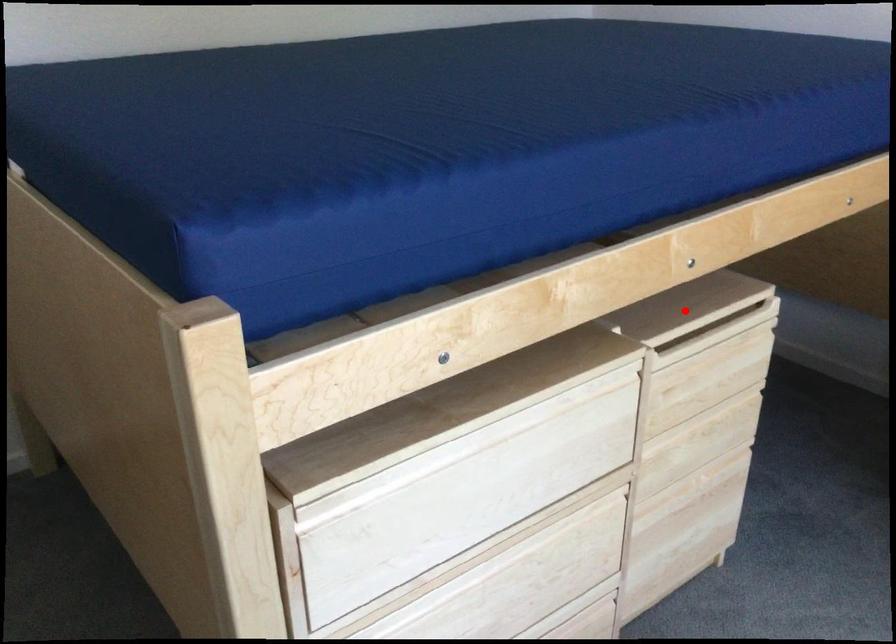
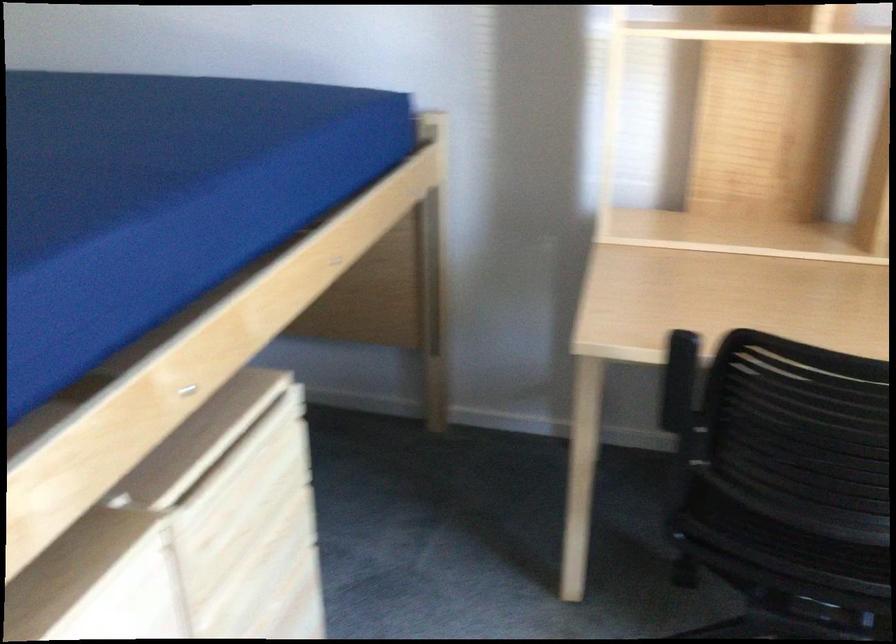
Question: I am providing you with two images of the same scene from different viewpoints. A red point is marked on the first image. Can you still see the location of the red point in image 2?

Choices:
 (A) Yes
 (B) No

Answer: (A)